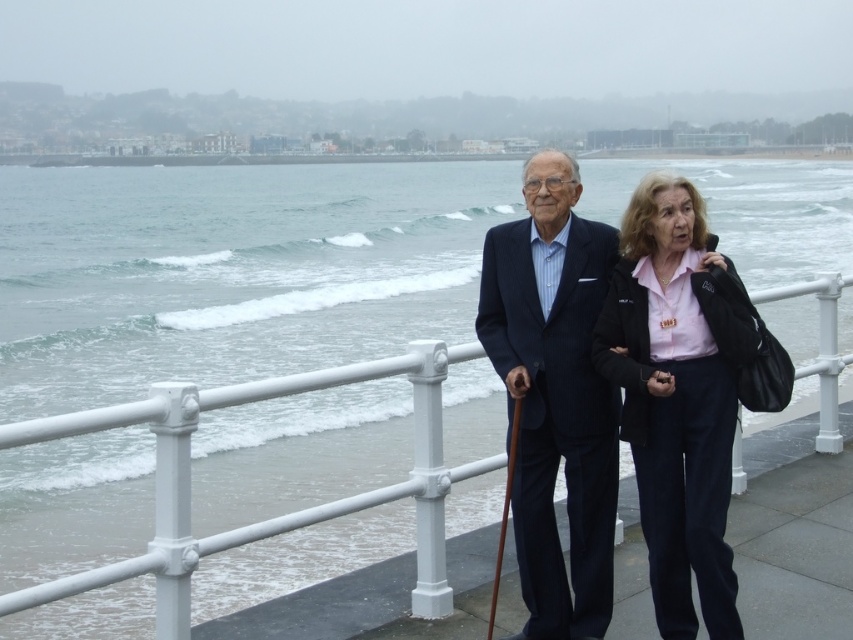
Question: In this image, where is pink matte shirt at center located relative to dark blue pinstripe suit at center?

Choices:
 (A) above
 (B) below

Answer: (A)

Question: Which point is closer to the camera?

Choices:
 (A) click(x=680, y=579)
 (B) click(x=467, y=355)
 (C) click(x=532, y=173)

Answer: (A)

Question: Is pink matte shirt at center to the left of white metal railing at center from the viewer's perspective?

Choices:
 (A) no
 (B) yes

Answer: (A)

Question: Can you confirm if pink matte shirt at center is bigger than white metal railing at center?

Choices:
 (A) yes
 (B) no

Answer: (A)

Question: Which of these objects is positioned closest to the white metal railing at center?

Choices:
 (A) pink matte shirt at center
 (B) dark blue pinstripe suit at center

Answer: (B)

Question: Which point is farther to the camera?

Choices:
 (A) (555, 403)
 (B) (672, 458)
 (C) (422, 509)

Answer: (C)